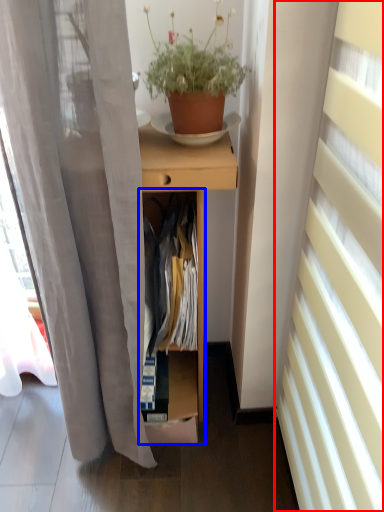
Question: Which of the following is the farthest to the observer, curtain (highlighted by a red box) or cabinet (highlighted by a blue box)?

Choices:
 (A) curtain
 (B) cabinet

Answer: (B)